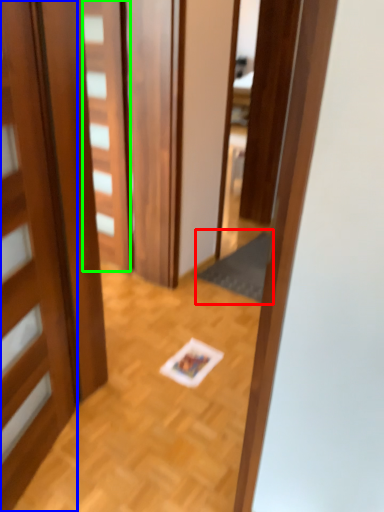
Question: Which object is the closest to the doormat (highlighted by a red box)? Choose among these: door (highlighted by a blue box) or door (highlighted by a green box).

Choices:
 (A) door
 (B) door

Answer: (B)